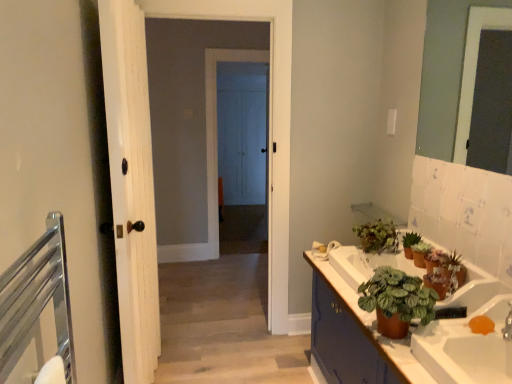
Question: Considering the positions of white wood door at left, placed as the second door when sorted from back to front, and green matte plant at upper right, the 1th houseplant when ordered from back to front, in the image, is white wood door at left, placed as the second door when sorted from back to front, wider or thinner than green matte plant at upper right, the 1th houseplant when ordered from back to front,?

Choices:
 (A) thin
 (B) wide

Answer: (A)

Question: Does point (118, 52) appear closer or farther from the camera than point (366, 246)?

Choices:
 (A) farther
 (B) closer

Answer: (B)

Question: Based on their relative distances, which object is farther from the white wood door at center, the first door in the back-to-front sequence?

Choices:
 (A) green matte plant at lower right, placed as the fourth houseplant when sorted from back to front
 (B) brown matte cabinet at lower right
 (C) silver metallic faucet at lower right
 (D) green matte plant at upper right, marked as the second houseplant in a front-to-back arrangement
 (E) white glossy sink at lower right

Answer: (C)

Question: Which object is positioned farthest from the brown matte cabinet at lower right?

Choices:
 (A) green matte plant at upper right
 (B) silver metallic faucet at lower right
 (C) green matte plant at upper right, which is the 4th houseplant from front to back
 (D) white wood door at center, which is the 2th door in front-to-back order
 (E) green matte plant at lower right, which is the 1th houseplant in front-to-back order

Answer: (D)